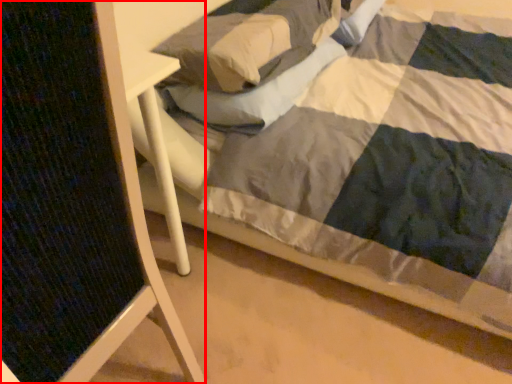
Question: Considering the relative positions of folding chair (annotated by the red box) and pillow in the image provided, where is folding chair (annotated by the red box) located with respect to the staircase?

Choices:
 (A) left
 (B) right

Answer: (A)